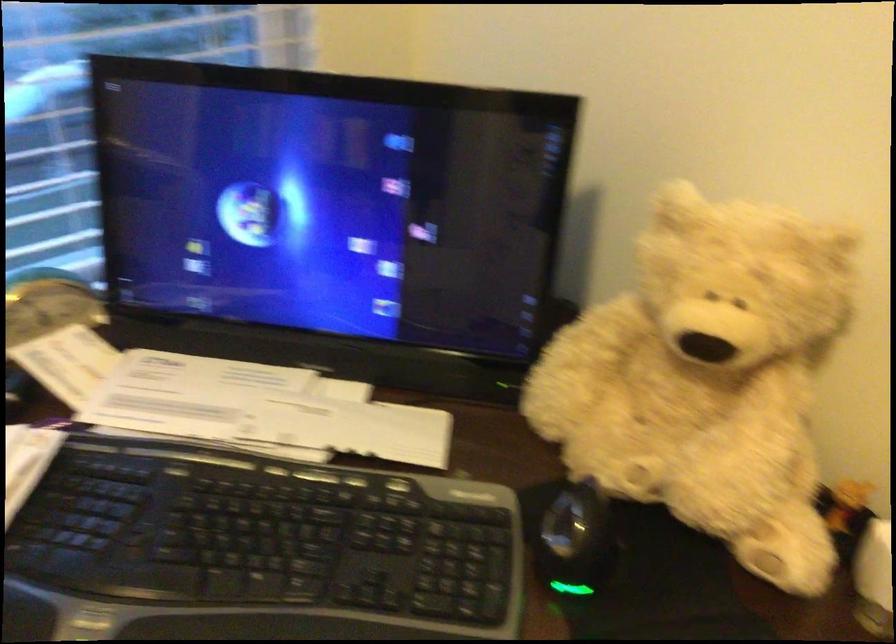
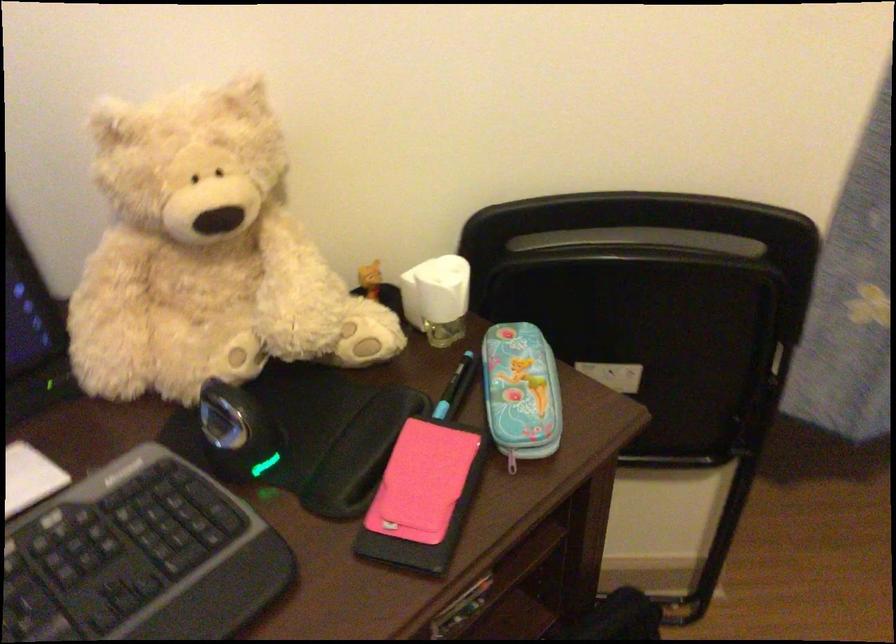
Question: The camera is either moving clockwise (left) or counter-clockwise (right) around the object. The first image is from the beginning of the video and the second image is from the end. Is the camera moving left or right when shooting the video?

Choices:
 (A) Left
 (B) Right

Answer: (A)